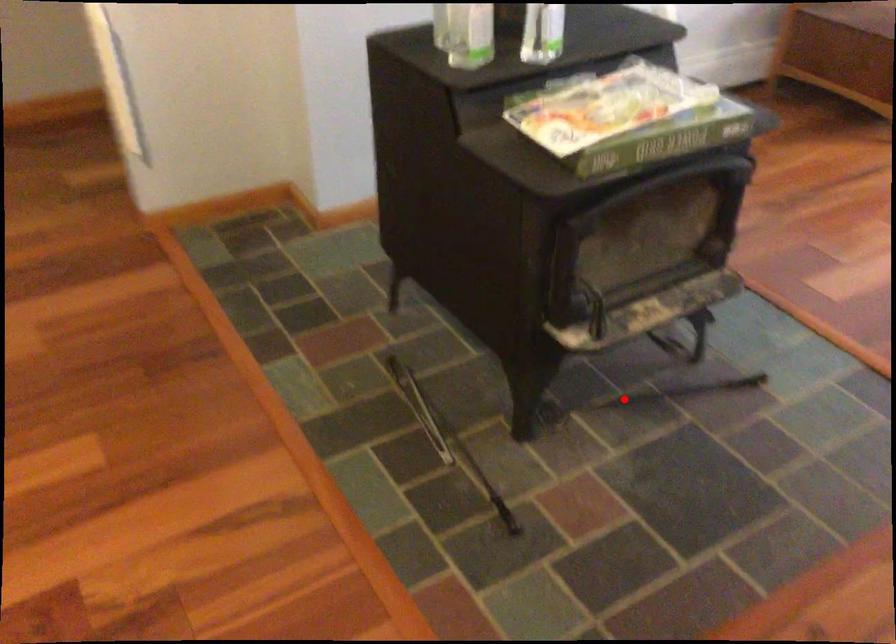
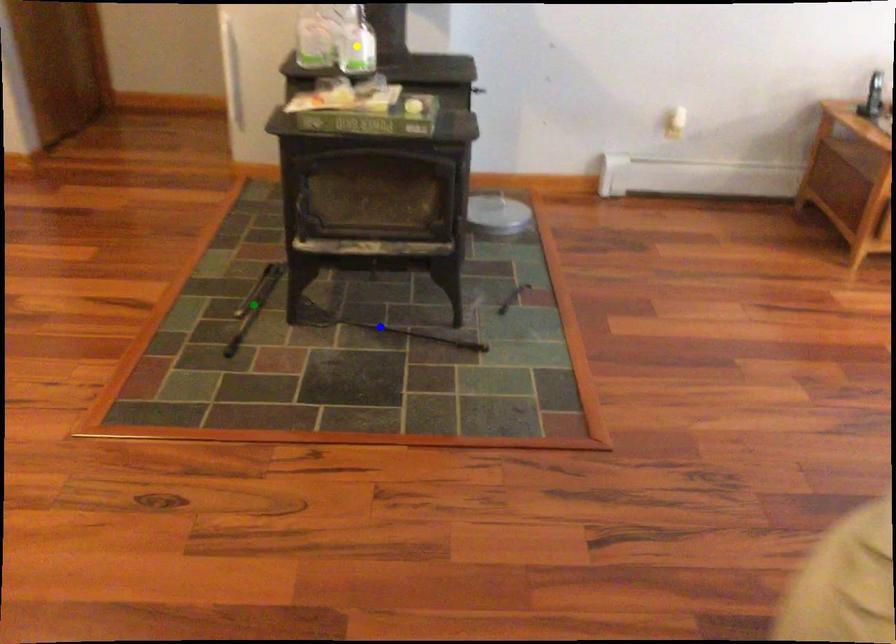
Question: I am providing you with two images of the same scene from different viewpoints. A red point is marked on the first image. You are given multiple points on the second image. Which point in image 2 represents the same 3d spot as the red point in image 1?

Choices:
 (A) green point
 (B) yellow point
 (C) blue point

Answer: (C)